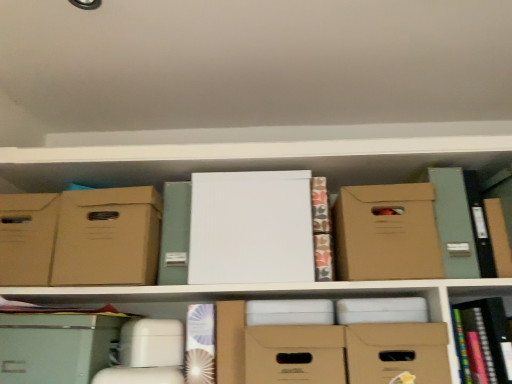
Question: Does white paper at center, which is the 2th book in right-to-left order, lie in front of matte cardboard box at center, arranged as the 3th storage box when viewed from the left?

Choices:
 (A) no
 (B) yes

Answer: (A)

Question: Is white paper at center, which is the 2th book in right-to-left order, further to camera compared to matte cardboard box at center, the second storage box in the right-to-left sequence?

Choices:
 (A) yes
 (B) no

Answer: (A)

Question: From a real-world perspective, is white paper at center, which is the 2th book in right-to-left order, over matte cardboard box at center, the second storage box in the right-to-left sequence?

Choices:
 (A) yes
 (B) no

Answer: (A)

Question: Considering the relative sizes of white paper at center, the 1th book positioned from the left, and matte cardboard box at center, arranged as the 3th storage box when viewed from the left, in the image provided, is white paper at center, the 1th book positioned from the left, smaller than matte cardboard box at center, arranged as the 3th storage box when viewed from the left,?

Choices:
 (A) yes
 (B) no

Answer: (A)

Question: Is white paper at center, the 1th book positioned from the left, wider than matte cardboard box at center, the second storage box in the right-to-left sequence?

Choices:
 (A) no
 (B) yes

Answer: (B)

Question: From the image's perspective, is matte cardboard box at lower center, which ranks as the 4th storage box in left-to-right order, above or below matte brown cardboard box at center-right, which is the 2th cardboard box in left-to-right order?

Choices:
 (A) above
 (B) below

Answer: (B)

Question: Is matte cardboard box at lower center, the first storage box in the right-to-left sequence, to the left or to the right of matte brown cardboard box at center-right, which is the 2th cardboard box in left-to-right order, in the image?

Choices:
 (A) right
 (B) left

Answer: (B)

Question: Is matte cardboard box at lower center, the first storage box in the right-to-left sequence, in front of or behind matte brown cardboard box at center-right, which is the 2th cardboard box in left-to-right order, in the image?

Choices:
 (A) front
 (B) behind

Answer: (A)

Question: Is matte cardboard box at lower center, the first storage box in the right-to-left sequence, situated inside matte brown cardboard box at center-right, which is the 2th cardboard box in left-to-right order, or outside?

Choices:
 (A) inside
 (B) outside

Answer: (B)

Question: Is white paper at center, the 1th paperback book in the left-to-right sequence, taller or shorter than matte green storage box at lower left, which is the second storage box in left-to-right order?

Choices:
 (A) short
 (B) tall

Answer: (B)

Question: Choose the correct answer: Is white paper at center, the second paperback book positioned from the right, inside matte green storage box at lower left, the third storage box positioned from the right, or outside it?

Choices:
 (A) inside
 (B) outside

Answer: (B)

Question: Considering the relative positions of white paper at center, the 1th paperback book in the left-to-right sequence, and matte green storage box at lower left, which is the second storage box in left-to-right order, in the image provided, is white paper at center, the 1th paperback book in the left-to-right sequence, to the left or to the right of matte green storage box at lower left, which is the second storage box in left-to-right order,?

Choices:
 (A) right
 (B) left

Answer: (A)

Question: From the image's perspective, is white paper at center, the 1th paperback book in the left-to-right sequence, located above or below matte green storage box at lower left, the third storage box positioned from the right?

Choices:
 (A) above
 (B) below

Answer: (A)

Question: Considering the positions of matte brown cardboard box at center-right, the first cardboard box in the right-to-left sequence, and white paper at center, the 1th book positioned from the left, in the image, is matte brown cardboard box at center-right, the first cardboard box in the right-to-left sequence, wider or thinner than white paper at center, the 1th book positioned from the left,?

Choices:
 (A) thin
 (B) wide

Answer: (B)

Question: Is matte brown cardboard box at center-right, the first cardboard box in the right-to-left sequence, taller or shorter than white paper at center, the 1th book positioned from the left?

Choices:
 (A) tall
 (B) short

Answer: (A)